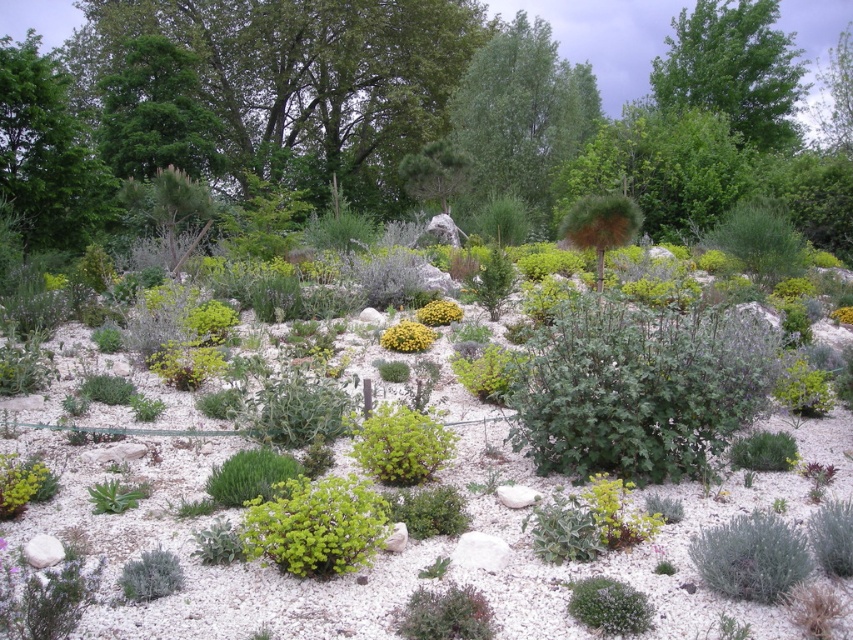
You are a gardener planning to plant a new flower bed between the green leafy tree at upper center and the green leafy plant at center. Considering their heights, which one might cast more shadow over the flower bed during midday?

The green leafy tree at upper center is much taller than the green leafy plant at center, so it will cast a larger shadow over the flower bed during midday.

You are standing in the garden and want to take a photo of the green leafy tree at upper right. If your camera has a maximum zoom range of 20 meters, will you be able to capture the tree clearly without moving closer?

The green leafy tree at upper right is 31.35 meters away from the camera, which exceeds the camera maximum zoom range of 20 meters. Therefore, you won not be able to capture the tree clearly without moving closer.

You are standing in the garden and want to reach the point at coordinates point (535, 35). If your walking speed is 1.5 meters per second, how many seconds will it take you to reach that point?

The point (535, 35) is 31.42 meters from the camera, so it will take approximately 20.95 seconds to reach it at a speed of 1.5 meters per second.